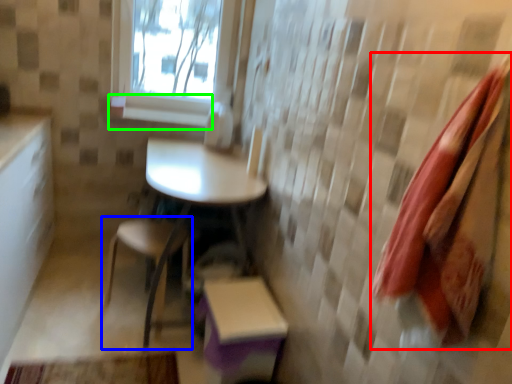
Question: Which is nearer to the beach towel (highlighted by a red box)? chair (highlighted by a blue box) or window sill (highlighted by a green box).

Choices:
 (A) chair
 (B) window sill

Answer: (A)